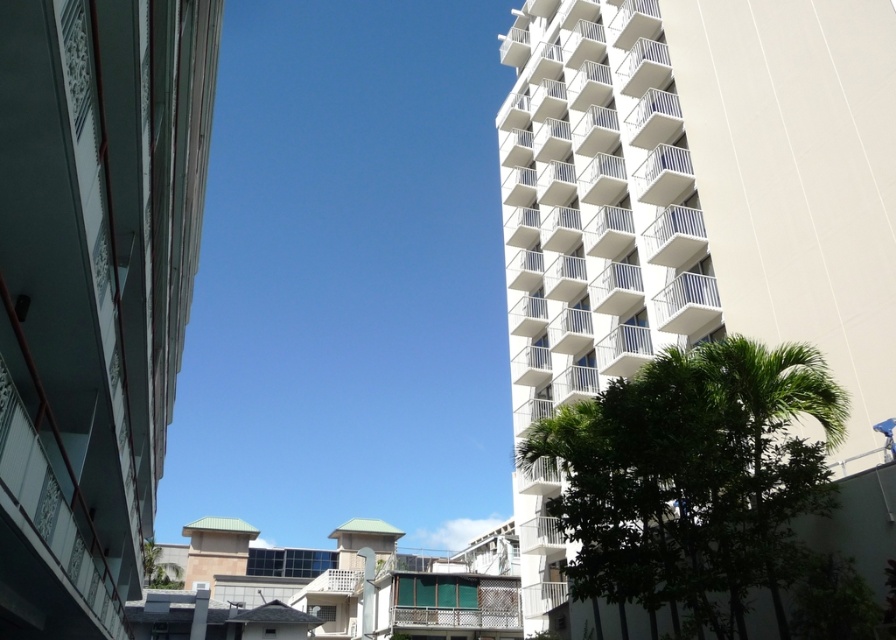
You are a photographer planning to capture both the white smooth building at right and the white smooth building at upper right in a single shot. Based on their positions, which building should you focus on first to ensure both are in frame?

The white smooth building at upper right should be focused on first because it is positioned lower than the white smooth building at right, allowing the photographer to frame both by adjusting the camera angle downward from the lower building upwards.

You are standing in front of the urban scene and want to take a photo of the white smooth building at right. If your camera can focus on objects up to 10 meters away, will it be able to capture the building clearly?

The white smooth building at right is 10.33 meters from the camera, which is slightly beyond the camera maximum focus range of 10 meters. Therefore, the camera may not be able to focus on the building clearly.

Based on the photo, you are standing in the middle of the urban scene and want to take a photo of both the white smooth building at right and the white smooth building at upper right. Which building should you position yourself closer to in order to include both in the frame without any obstructions?

You should position yourself closer to the white smooth building at right because the white smooth building at upper right is behind it, allowing both to be visible in the frame without obstruction.